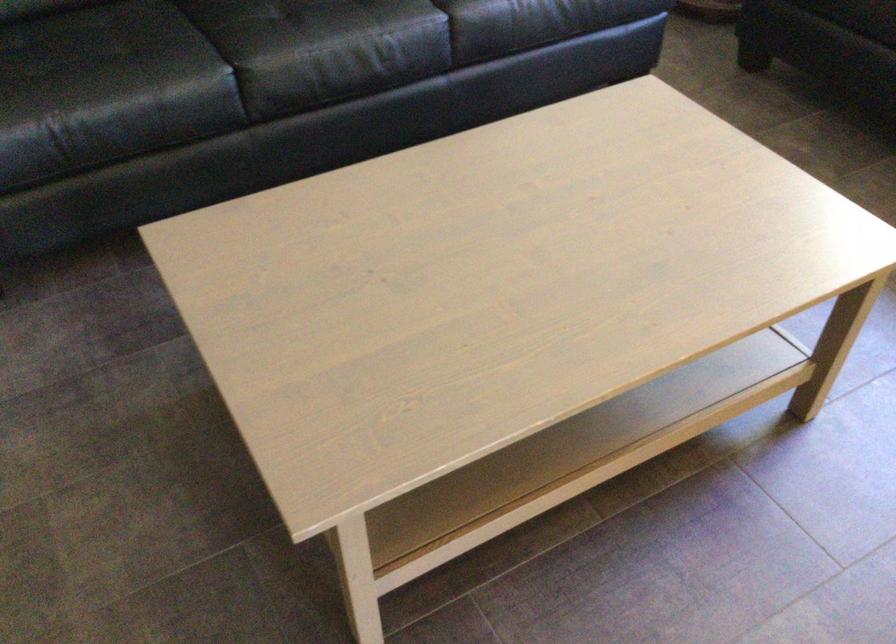
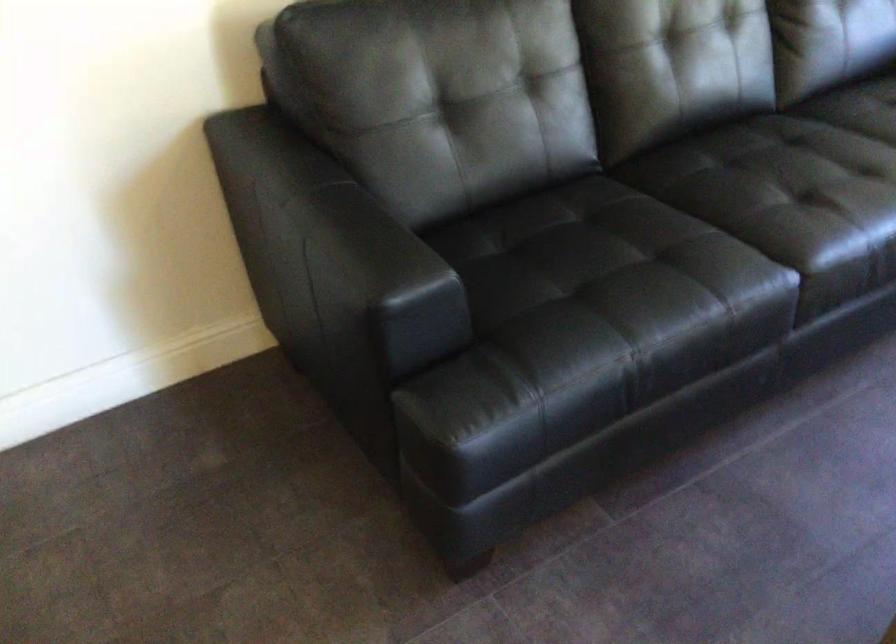
In a continuous first-person perspective shot, in which direction is the camera moving?

The cameraman moved toward left, forward.